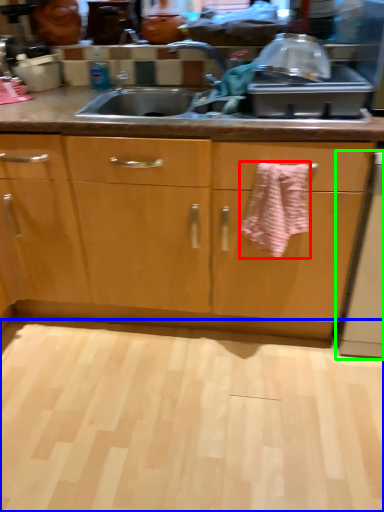
Question: Which is nearer to the bath towel (highlighted by a red box)? plain (highlighted by a blue box) or dish washer (highlighted by a green box).

Choices:
 (A) plain
 (B) dish washer

Answer: (B)